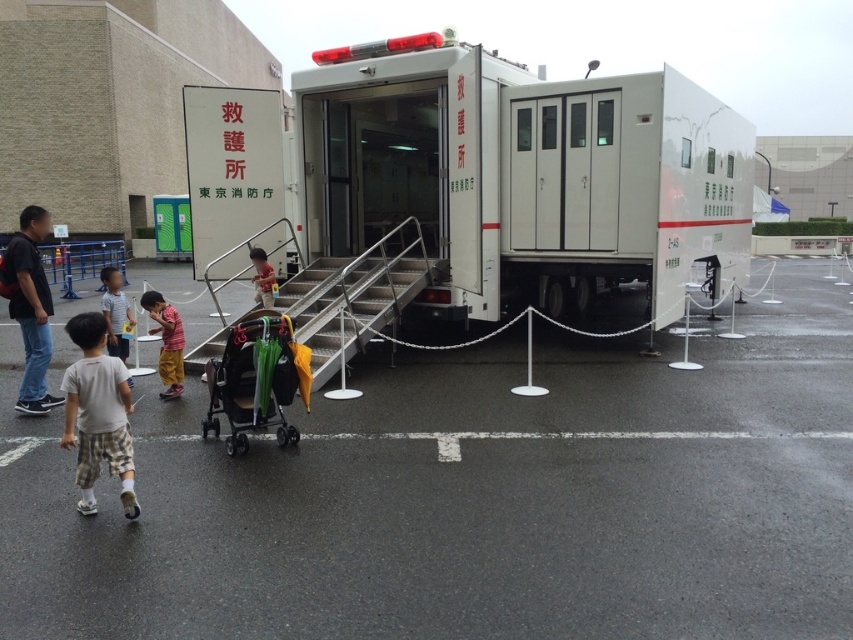
Between white matte truck at center and matte black shirt at left, which one is positioned lower?

white matte truck at center is below.

Which is behind, point (389, 48) or point (35, 365)?

The point (389, 48) is behind.

Locate an element on the screen. Image resolution: width=853 pixels, height=640 pixels. white matte truck at center is located at coordinates (521, 177).

Is metallic silver stairs at center above matte yellow backpack at center?

Actually, metallic silver stairs at center is below matte yellow backpack at center.

Is metallic silver stairs at center taller than matte yellow backpack at center?

Indeed, metallic silver stairs at center has a greater height compared to matte yellow backpack at center.

Where is `metallic silver stairs at center`? The width and height of the screenshot is (853, 640). metallic silver stairs at center is located at coordinates (351, 301).

Measure the distance between metallic silver stairs at center and camera.

metallic silver stairs at center is 7.57 meters from camera.

Is metallic silver stairs at center wider than matte black shirt at left?

No, metallic silver stairs at center is not wider than matte black shirt at left.

What do you see at coordinates (351, 301) in the screenshot?
I see `metallic silver stairs at center` at bounding box center [351, 301].

This screenshot has width=853, height=640. In order to click on metallic silver stairs at center in this screenshot , I will do `click(351, 301)`.